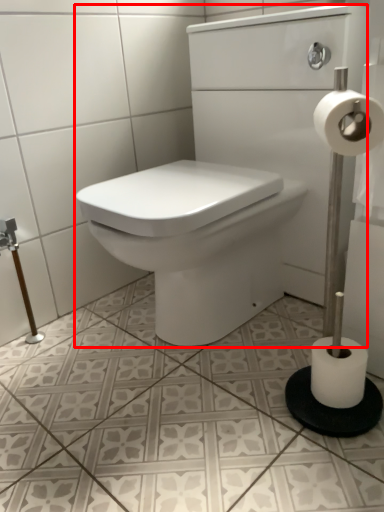
Question: From the image's perspective, where is sink (annotated by the red box) located in relation to toilet paper in the image?

Choices:
 (A) below
 (B) above

Answer: (B)